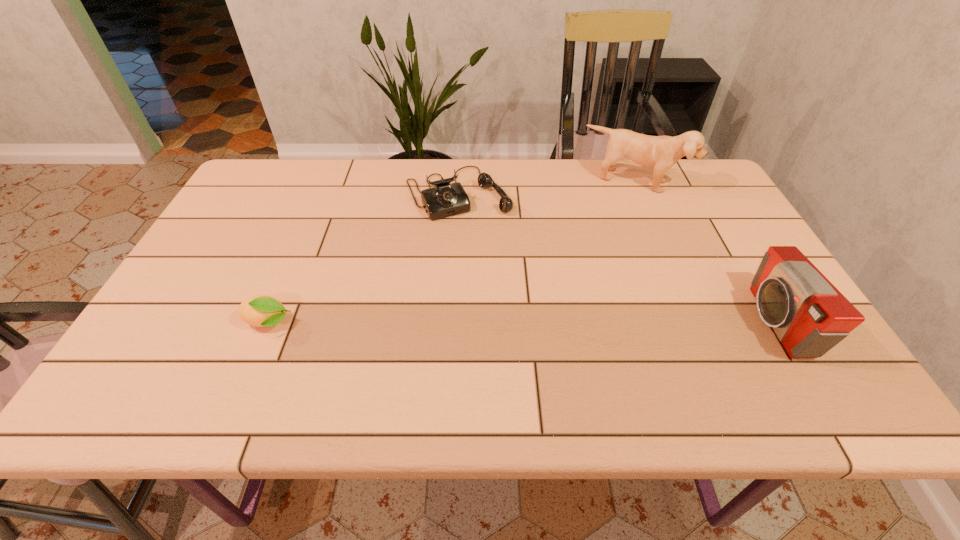
Point out which object is positioned as the second nearest to the tallest object. Please provide its 2D coordinates. Your answer should be formatted as a tuple, i.e. [(x, y)], where the tuple contains the x and y coordinates of a point satisfying the conditions above.

[(809, 315)]

Where is `vacant area in the image that satisfies the following two spatial constraints: 1. on the front side of the camera; 2. on the front-facing side of the puppy`? The image size is (960, 540). vacant area in the image that satisfies the following two spatial constraints: 1. on the front side of the camera; 2. on the front-facing side of the puppy is located at coordinates (697, 321).